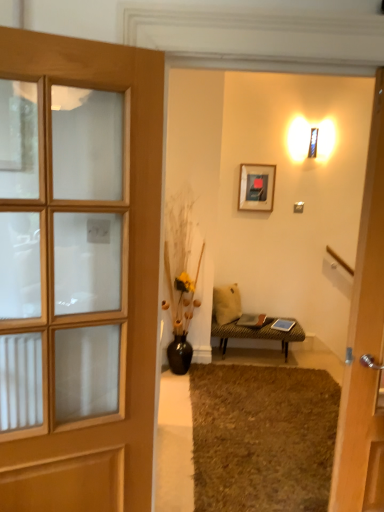
Question: Is matte black picture frame at upper center wider than brown shaggy rug at lower center?

Choices:
 (A) no
 (B) yes

Answer: (A)

Question: Does matte black picture frame at upper center lie behind brown shaggy rug at lower center?

Choices:
 (A) no
 (B) yes

Answer: (B)

Question: Does matte black picture frame at upper center appear on the left side of brown shaggy rug at lower center?

Choices:
 (A) no
 (B) yes

Answer: (B)

Question: Is matte black picture frame at upper center positioned far away from brown shaggy rug at lower center?

Choices:
 (A) no
 (B) yes

Answer: (B)

Question: From a real-world perspective, is matte black picture frame at upper center below brown shaggy rug at lower center?

Choices:
 (A) no
 (B) yes

Answer: (A)

Question: Which is correct: leather textured bench at center is inside brown shaggy rug at lower center, or outside of it?

Choices:
 (A) outside
 (B) inside

Answer: (A)

Question: Is leather textured bench at center in front of or behind brown shaggy rug at lower center in the image?

Choices:
 (A) front
 (B) behind

Answer: (B)

Question: Based on their positions, is leather textured bench at center located to the left or right of brown shaggy rug at lower center?

Choices:
 (A) right
 (B) left

Answer: (A)

Question: Is point (286, 340) positioned closer to the camera than point (223, 386)?

Choices:
 (A) farther
 (B) closer

Answer: (A)

Question: From a real-world perspective, is brown shaggy rug at lower center above or below black ceramic vase at center?

Choices:
 (A) below
 (B) above

Answer: (A)

Question: Is brown shaggy rug at lower center wider or thinner than black ceramic vase at center?

Choices:
 (A) thin
 (B) wide

Answer: (B)

Question: In the image, is brown shaggy rug at lower center on the left side or the right side of black ceramic vase at center?

Choices:
 (A) left
 (B) right

Answer: (B)

Question: Considering their positions, is brown shaggy rug at lower center located in front of or behind black ceramic vase at center?

Choices:
 (A) behind
 (B) front

Answer: (B)

Question: From a real-world perspective, is beige fabric pillow at center above or below brown shaggy rug at lower center?

Choices:
 (A) above
 (B) below

Answer: (A)

Question: Is point (225, 312) positioned closer to the camera than point (230, 464)?

Choices:
 (A) farther
 (B) closer

Answer: (A)